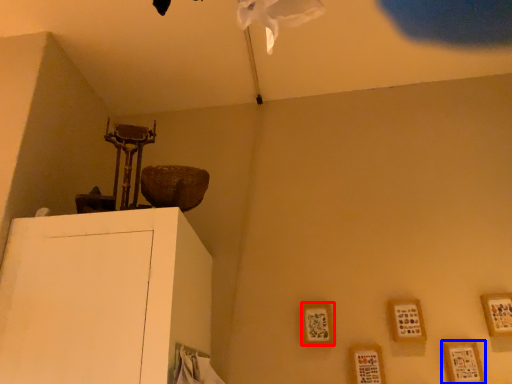
Question: Among these objects, which one is nearest to the camera, picture frame (highlighted by a red box) or picture frame (highlighted by a blue box)?

Choices:
 (A) picture frame
 (B) picture frame

Answer: (B)